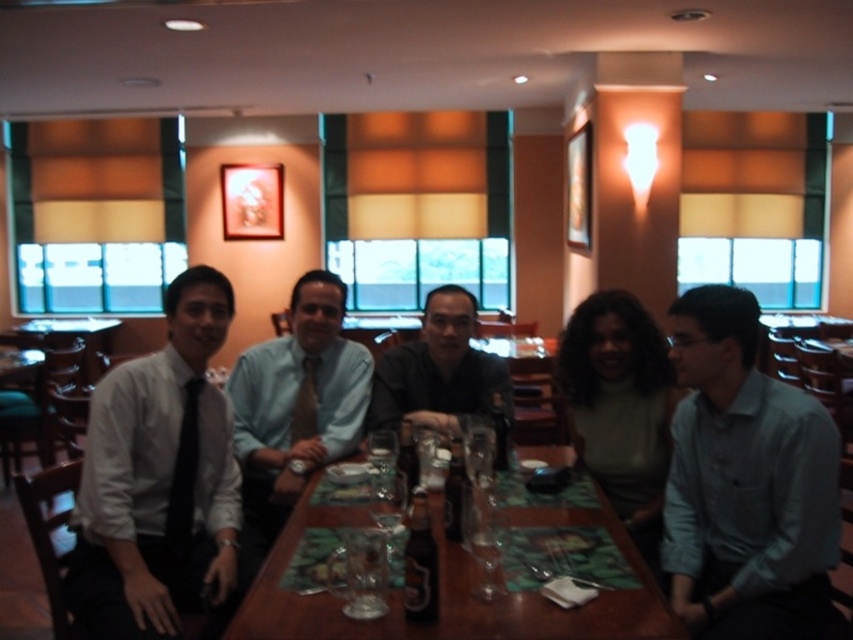
You are a photographer adjusting the camera settings to capture a closeup of the matte gray shirt at center and the black silk tie at left. Since you want to ensure both are in focus, you need to know which object is wider. Which one is wider?

The matte gray shirt at center is wider than the black silk tie at left according to the description, so you should adjust the camera focus to accommodate its wider size.

Consider the image. What object is located at the coordinates point (451, 588)?

The wooden table at center is located at point (451, 588).

You are a server in a restaurant and need to place a 1.2 meter long platter on the wooden table at center. Can you fit it on the table if the brown silk tie at center is already placed at the center?

The wooden table at center has a width larger than the brown silk tie at center. Since the platter is 1.2 meters long and the table is wider than the tie, it should fit, provided there are no other obstructions.